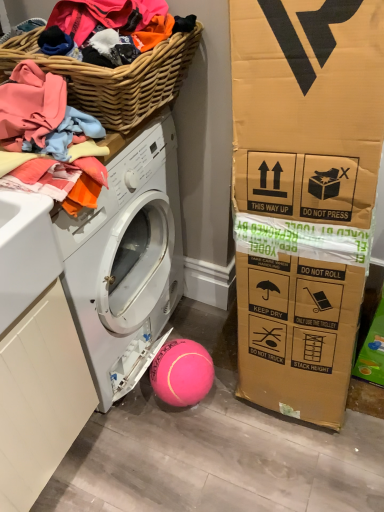
What is the approximate height of soft cotton clothes at upper left?

11.04 inches.

Image resolution: width=384 pixels, height=512 pixels. I want to click on woven wood basket at upper left, so click(x=113, y=78).

Which point is more distant from viewer, (115,148) or (145,62)?

Positioned behind is point (115,148).

Is white matte washing machine at lower left taller than woven wood basket at upper left?

Indeed, white matte washing machine at lower left has a greater height compared to woven wood basket at upper left.

From a real-world perspective, between white matte washing machine at lower left and woven wood basket at upper left, who is vertically lower?

In real-world perspective, white matte washing machine at lower left is lower.

Can woven wood basket at upper left be found inside white matte washing machine at lower left?

No, white matte washing machine at lower left does not contain woven wood basket at upper left.

Is pink rubber ball at lower center taller than soft cotton clothes at upper left?

In fact, pink rubber ball at lower center may be shorter than soft cotton clothes at upper left.

Is pink rubber ball at lower center spatially inside soft cotton clothes at upper left, or outside of it?

The correct answer is: outside.

Can you confirm if pink rubber ball at lower center is wider than soft cotton clothes at upper left?

No.

Can you tell me how much pink rubber ball at lower center and soft cotton clothes at upper left differ in facing direction?

pink rubber ball at lower center and soft cotton clothes at upper left are facing 92 degrees away from each other.

Which object is thinner, soft cotton clothes at upper left or woven wood basket at upper left?

Thinner between the two is soft cotton clothes at upper left.

How different are the orientations of soft cotton clothes at upper left and woven wood basket at upper left in degrees?

0.0016 degrees.

Does soft cotton clothes at upper left have a lesser height compared to woven wood basket at upper left?

Incorrect, the height of soft cotton clothes at upper left does not fall short of that of woven wood basket at upper left.

From a real-world perspective, is soft cotton clothes at upper left located higher than woven wood basket at upper left?

Actually, soft cotton clothes at upper left is physically below woven wood basket at upper left in the real world.

Is woven wood basket at upper left aimed at pink rubber ball at lower center?

No, woven wood basket at upper left is not turned towards pink rubber ball at lower center.

Can you tell me how much woven wood basket at upper left and pink rubber ball at lower center differ in facing direction?

92 degrees separate the facing orientations of woven wood basket at upper left and pink rubber ball at lower center.

Image resolution: width=384 pixels, height=512 pixels. Identify the location of basket that appears above the pink rubber ball at lower center (from the image's perspective). (113, 78).

Based on their positions, is woven wood basket at upper left located to the left or right of pink rubber ball at lower center?

Based on their positions, woven wood basket at upper left is located to the left of pink rubber ball at lower center.

Is woven wood basket at upper left outside of white matte washing machine at lower left?

That's correct, woven wood basket at upper left is outside of white matte washing machine at lower left.

Looking at this image, looking at the image, does woven wood basket at upper left seem bigger or smaller compared to white matte washing machine at lower left?

In the image, woven wood basket at upper left appears to be smaller than white matte washing machine at lower left.

Based on the photo, which object is positioned more to the left, woven wood basket at upper left or white matte washing machine at lower left?

white matte washing machine at lower left is more to the left.

How much distance is there between woven wood basket at upper left and white matte washing machine at lower left?

woven wood basket at upper left is 12.43 inches from white matte washing machine at lower left.

Does soft cotton clothes at upper left have a lesser width compared to white matte washing machine at lower left?

Yes, soft cotton clothes at upper left is thinner than white matte washing machine at lower left.

Is soft cotton clothes at upper left at the left side of white matte washing machine at lower left?

Incorrect, soft cotton clothes at upper left is not on the left side of white matte washing machine at lower left.

From a real-world perspective, which object rests below the other?

From a 3D spatial view, white matte washing machine at lower left is below.

Can we say soft cotton clothes at upper left lies outside white matte washing machine at lower left?

That's correct, soft cotton clothes at upper left is outside of white matte washing machine at lower left.

From the picture: Considering the sizes of objects white matte washing machine at lower left and soft cotton clothes at upper left in the image provided, who is bigger, white matte washing machine at lower left or soft cotton clothes at upper left?

white matte washing machine at lower left.

Considering the positions of objects white matte washing machine at lower left and soft cotton clothes at upper left in the image provided, who is more to the right, white matte washing machine at lower left or soft cotton clothes at upper left?

From the viewer's perspective, soft cotton clothes at upper left appears more on the right side.

Would you say white matte washing machine at lower left is a long distance from soft cotton clothes at upper left?

No, white matte washing machine at lower left is not far away from soft cotton clothes at upper left.

From the image's perspective, between white matte washing machine at lower left and soft cotton clothes at upper left, which one is located above?

From the image's view, soft cotton clothes at upper left is above.

Identify the location of washing machine directly beneath the woven wood basket at upper left (from a real-world perspective). This screenshot has height=512, width=384. (126, 258).

Where is `clothing in front of the pink rubber ball at lower center`? clothing in front of the pink rubber ball at lower center is located at coordinates 49,139.

Considering their positions, is pink rubber ball at lower center positioned closer to soft cotton clothes at upper left than woven wood basket at upper left?

Based on the image, woven wood basket at upper left appears to be nearer to soft cotton clothes at upper left.

When comparing their distances from woven wood basket at upper left, does soft cotton clothes at upper left or white matte washing machine at lower left seem closer?

soft cotton clothes at upper left lies closer to woven wood basket at upper left than the other object.

Looking at the image, which one is located further to pink rubber ball at lower center, white matte washing machine at lower left or woven wood basket at upper left?

woven wood basket at upper left lies further to pink rubber ball at lower center than the other object.

When comparing their distances from white matte washing machine at lower left, does soft cotton clothes at upper left or woven wood basket at upper left seem closer?

soft cotton clothes at upper left lies closer to white matte washing machine at lower left than the other object.

Estimate the real-world distances between objects in this image. Which object is further from pink rubber ball at lower center, woven wood basket at upper left or white matte washing machine at lower left?

The object further to pink rubber ball at lower center is woven wood basket at upper left.

Estimate the real-world distances between objects in this image. Which object is closer to soft cotton clothes at upper left, white matte washing machine at lower left or pink rubber ball at lower center?

white matte washing machine at lower left.

Considering their positions, is white matte washing machine at lower left positioned further to woven wood basket at upper left than pink rubber ball at lower center?

pink rubber ball at lower center is further to woven wood basket at upper left.

Based on the photo, based on their spatial positions, is woven wood basket at upper left or white matte washing machine at lower left further from soft cotton clothes at upper left?

The object further to soft cotton clothes at upper left is white matte washing machine at lower left.

This screenshot has width=384, height=512. Find the location of `washing machine between soft cotton clothes at upper left and pink rubber ball at lower center from top to bottom`. washing machine between soft cotton clothes at upper left and pink rubber ball at lower center from top to bottom is located at coordinates (126, 258).

Locate an element on the screen. The image size is (384, 512). clothing between woven wood basket at upper left and pink rubber ball at lower center vertically is located at coordinates (49, 139).

Where is `washing machine between woven wood basket at upper left and pink rubber ball at lower center from top to bottom`? The width and height of the screenshot is (384, 512). washing machine between woven wood basket at upper left and pink rubber ball at lower center from top to bottom is located at coordinates (126, 258).

Image resolution: width=384 pixels, height=512 pixels. In order to click on clothing between woven wood basket at upper left and white matte washing machine at lower left vertically in this screenshot , I will do `click(49, 139)`.